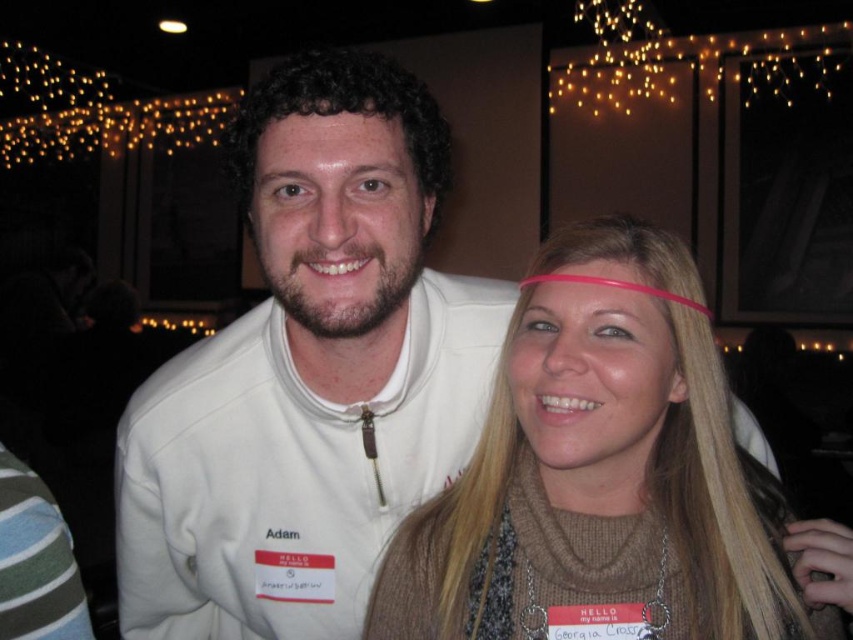
Question: Is white fleece jacket at center above blonde hair at center?

Choices:
 (A) no
 (B) yes

Answer: (A)

Question: Which object appears closest to the camera in this image?

Choices:
 (A) white fleece jacket at center
 (B) blonde hair at center
 (C) shiny skin forehead at center

Answer: (B)

Question: Which point appears farthest from the camera in this image?

Choices:
 (A) (320, 131)
 (B) (438, 483)
 (C) (444, 557)

Answer: (B)

Question: Can you confirm if white fleece jacket at center is positioned below shiny skin forehead at center?

Choices:
 (A) yes
 (B) no

Answer: (A)

Question: Can you confirm if white fleece jacket at center is positioned above shiny skin forehead at center?

Choices:
 (A) no
 (B) yes

Answer: (A)

Question: Which of the following is the farthest from the observer?

Choices:
 (A) (328, 170)
 (B) (322, 461)
 (C) (386, 609)

Answer: (B)